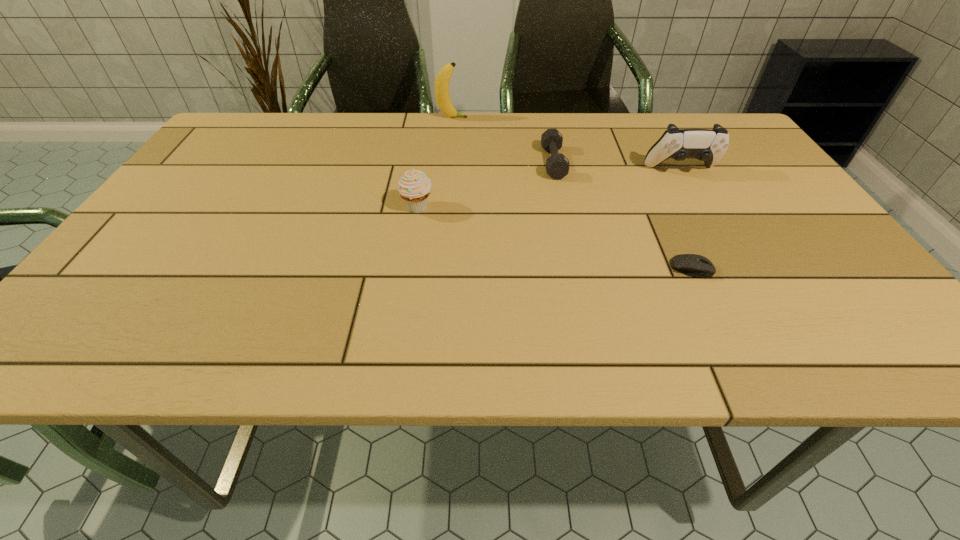
At what (x,y) coordinates should I click in order to perform the action: click on free space at the right edge of the desktop. Please return your answer as a coordinate pair (x, y). Image resolution: width=960 pixels, height=540 pixels. Looking at the image, I should click on (762, 225).

The height and width of the screenshot is (540, 960). In the image, there is a desktop. In order to click on vacant region at the far left corner in this screenshot , I will do `click(241, 147)`.

In the image, there is a desktop. What are the coordinates of `vacant space at the near right corner` in the screenshot? It's located at (856, 343).

Where is `vacant region between the muffin and the shortest object`? The image size is (960, 540). vacant region between the muffin and the shortest object is located at coordinates (555, 238).

The image size is (960, 540). I want to click on vacant area that lies between the shortest object and the farthest object, so click(x=572, y=193).

This screenshot has height=540, width=960. Find the location of `free area in between the control and the dumbbell`. free area in between the control and the dumbbell is located at coordinates (617, 166).

This screenshot has height=540, width=960. I want to click on empty space between the third object from left to right and the nearest object, so click(x=622, y=215).

This screenshot has height=540, width=960. Identify the location of free space between the control and the second shortest object. [617, 166].

Locate an element on the screen. Image resolution: width=960 pixels, height=540 pixels. free space between the computer equipment and the dumbbell is located at coordinates (622, 215).

Identify the location of empty space between the third object from left to right and the control. The height and width of the screenshot is (540, 960). (617, 166).